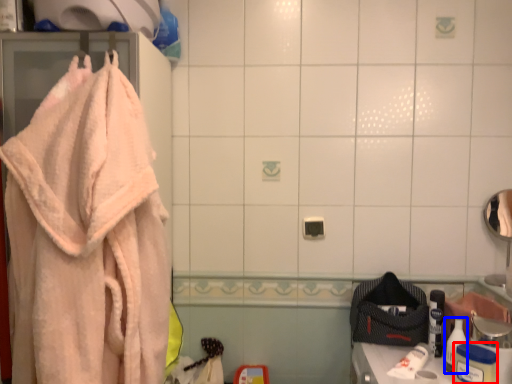
Question: Which object is closer to the camera taking this photo, toiletry (highlighted by a red box) or toiletry (highlighted by a blue box)?

Choices:
 (A) toiletry
 (B) toiletry

Answer: (A)